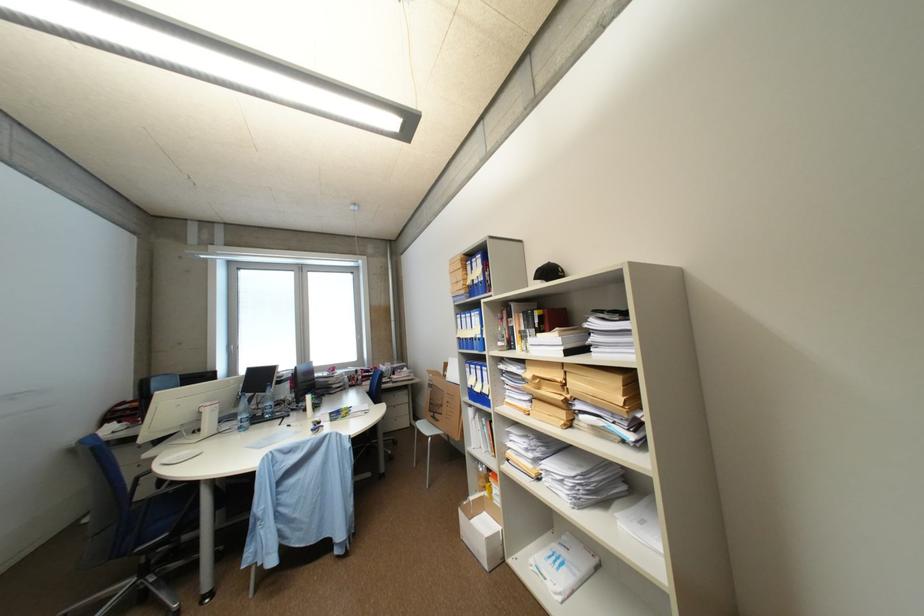
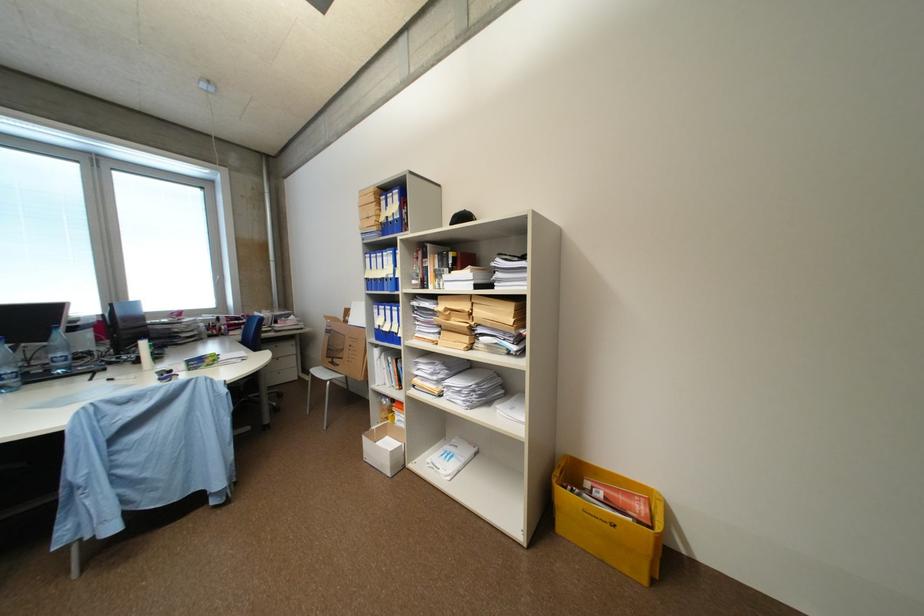
The point at (545,272) is marked in the first image. Where is the corresponding point in the second image?

(463, 217)